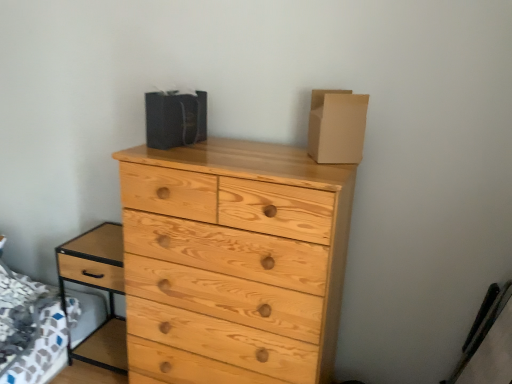
Question: Does light brown wood nightstand at lower left have a lesser width compared to natural wood chest of drawers at center?

Choices:
 (A) yes
 (B) no

Answer: (A)

Question: Is light brown wood nightstand at lower left facing away from natural wood chest of drawers at center?

Choices:
 (A) no
 (B) yes

Answer: (A)

Question: Is light brown wood nightstand at lower left oriented towards natural wood chest of drawers at center?

Choices:
 (A) no
 (B) yes

Answer: (A)

Question: Can you confirm if light brown wood nightstand at lower left is positioned to the right of natural wood chest of drawers at center?

Choices:
 (A) no
 (B) yes

Answer: (A)

Question: Is light brown wood nightstand at lower left completely or partially outside of natural wood chest of drawers at center?

Choices:
 (A) yes
 (B) no

Answer: (A)

Question: Is light brown wood nightstand at lower left positioned in front of natural wood chest of drawers at center?

Choices:
 (A) no
 (B) yes

Answer: (A)

Question: Does brown cardboard box at upper right, which appears as the 1th cardboard box when viewed from the right, have a larger size compared to light brown wood nightstand at lower left?

Choices:
 (A) yes
 (B) no

Answer: (B)

Question: Is brown cardboard box at upper right, the second cardboard box viewed from the left, wider than light brown wood nightstand at lower left?

Choices:
 (A) no
 (B) yes

Answer: (A)

Question: Is brown cardboard box at upper right, the second cardboard box viewed from the left, positioned before light brown wood nightstand at lower left?

Choices:
 (A) no
 (B) yes

Answer: (B)

Question: Is brown cardboard box at upper right, the second cardboard box viewed from the left, thinner than light brown wood nightstand at lower left?

Choices:
 (A) yes
 (B) no

Answer: (A)

Question: From a real-world perspective, is brown cardboard box at upper right, which appears as the 1th cardboard box when viewed from the right, below light brown wood nightstand at lower left?

Choices:
 (A) no
 (B) yes

Answer: (A)

Question: Is brown cardboard box at upper right, which appears as the 1th cardboard box when viewed from the right, taller than light brown wood nightstand at lower left?

Choices:
 (A) no
 (B) yes

Answer: (A)

Question: Is matte black bag at upper center, the second cardboard box positioned from the right, thinner than light brown wood nightstand at lower left?

Choices:
 (A) yes
 (B) no

Answer: (A)